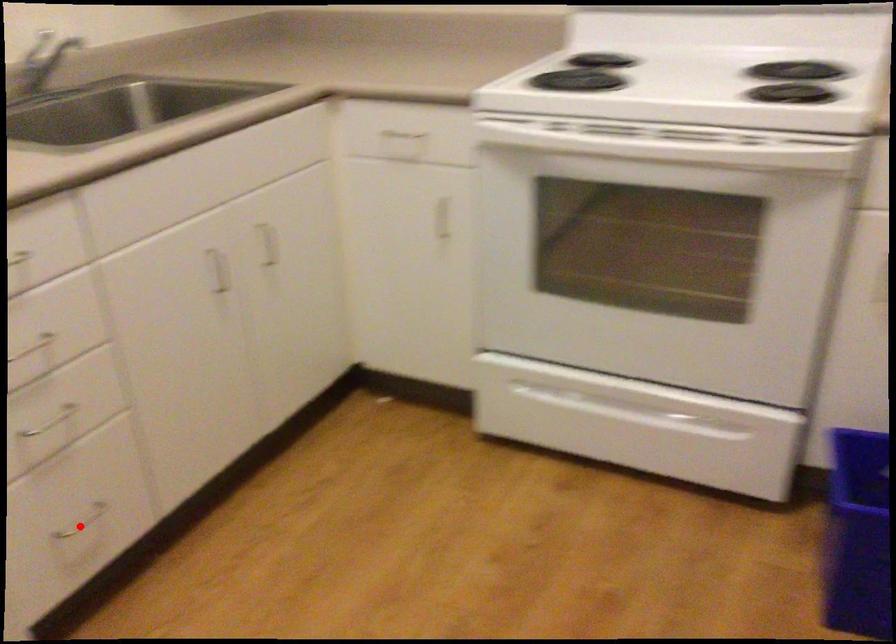
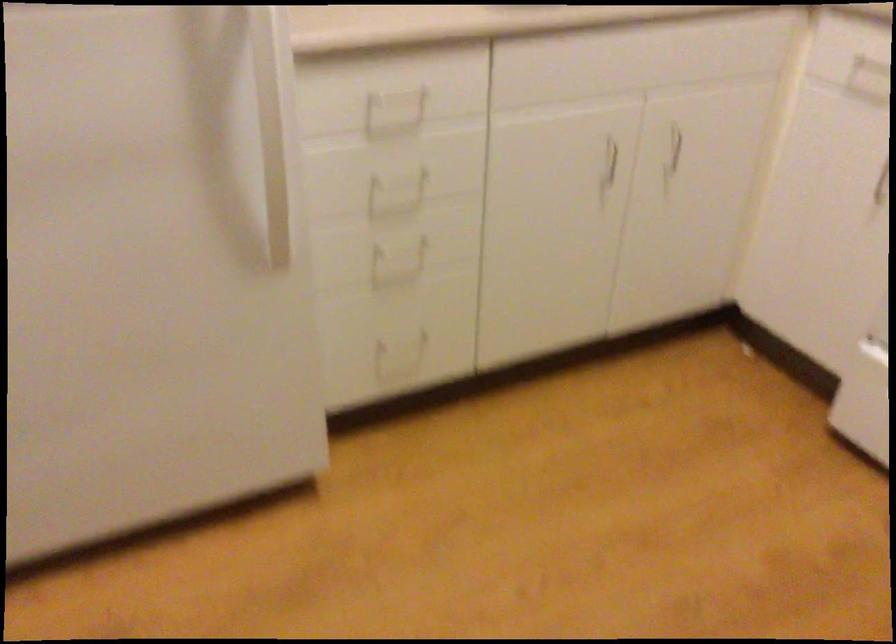
In the second image, find the point that corresponds to the highlighted location in the first image.

(401, 345)